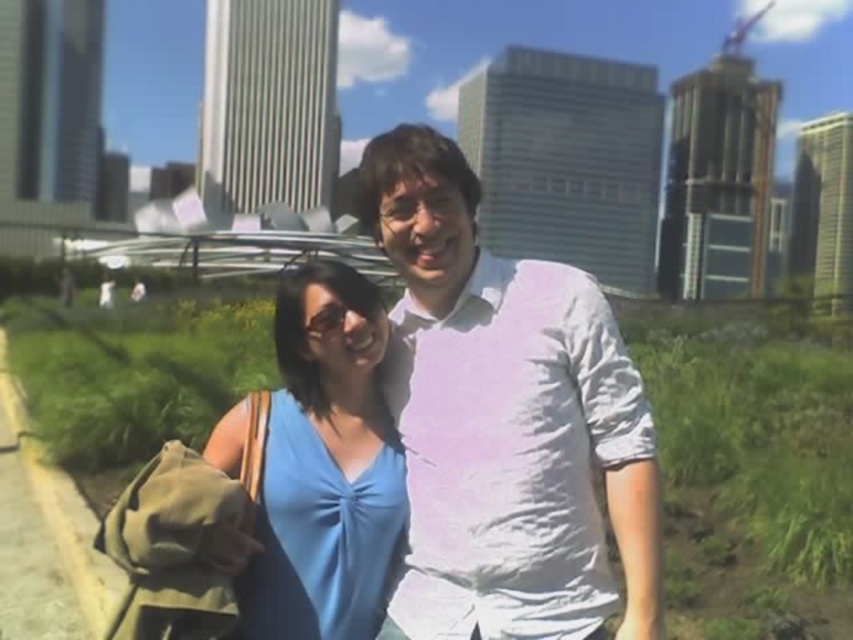
Question: Among these points, which one is nearest to the camera?

Choices:
 (A) (395, 444)
 (B) (635, 630)

Answer: (B)

Question: Can you confirm if white cotton shirt at center is thinner than blue fabric dress at center?

Choices:
 (A) no
 (B) yes

Answer: (B)

Question: Among these points, which one is nearest to the camera?

Choices:
 (A) (347, 577)
 (B) (445, 605)

Answer: (B)

Question: Does white cotton shirt at center appear over blue fabric dress at center?

Choices:
 (A) no
 (B) yes

Answer: (B)

Question: Can you confirm if white cotton shirt at center is positioned to the left of blue fabric dress at center?

Choices:
 (A) no
 (B) yes

Answer: (A)